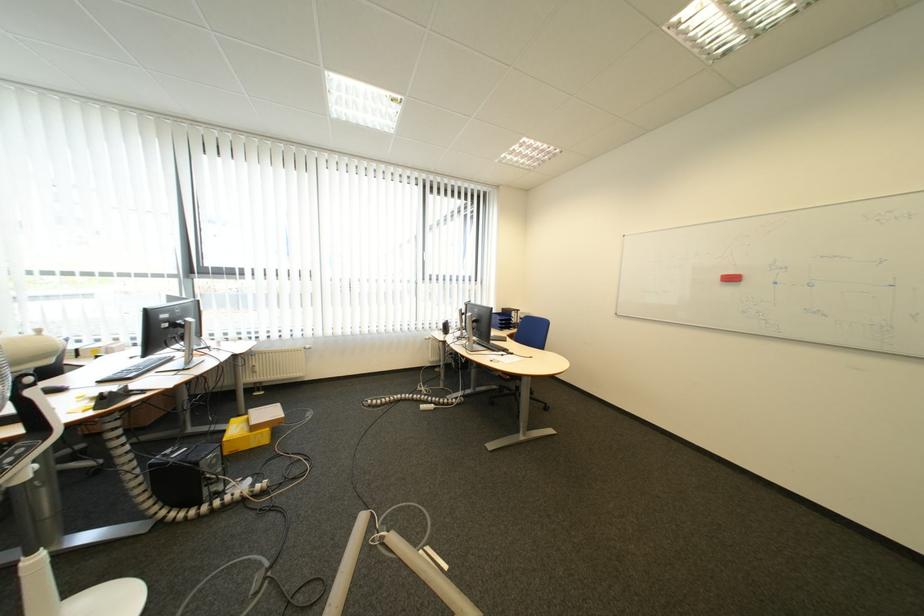
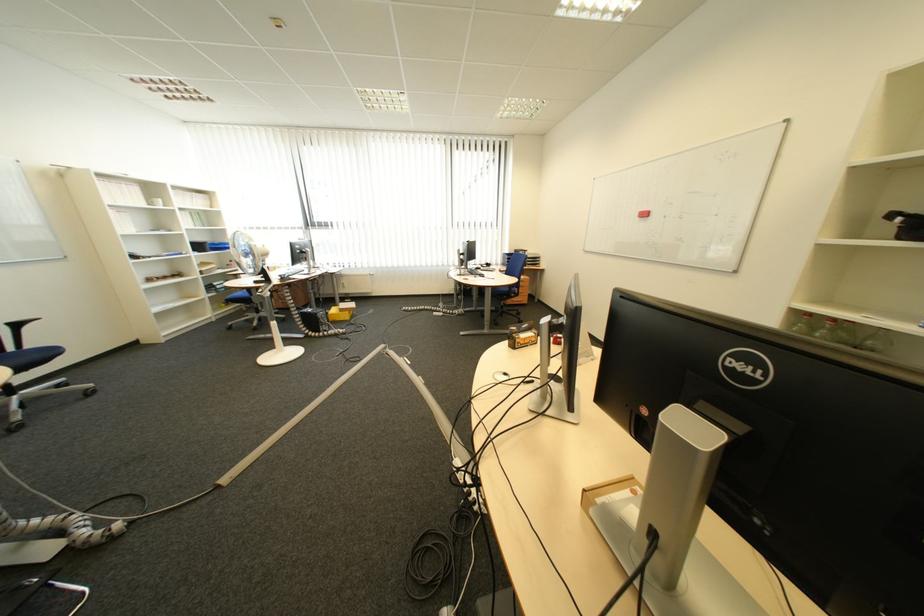
Find the pixel in the second image that matches point (788, 285) in the first image.

(677, 217)